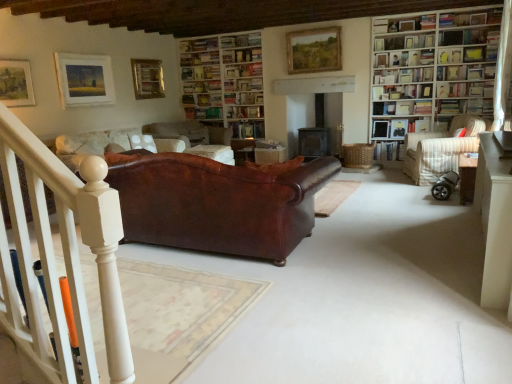
This screenshot has width=512, height=384. Identify the location of hardcover book at center, arranged as the 6th book when viewed from the right. (248, 129).

Describe the element at coordinates (314, 50) in the screenshot. I see `wooden picture frame at upper center, which appears as the second picture frame when viewed from the back` at that location.

The height and width of the screenshot is (384, 512). What are the coordinates of `black rubber baby carriage at lower right` in the screenshot? It's located at (445, 186).

This screenshot has height=384, width=512. I want to click on hardcover book at center, which is the 3th book from left to right, so click(x=248, y=129).

From a real-world perspective, is hardcover book at center, which is the 3th book from left to right, located higher than hardcover book at upper right, the fifth book positioned from the left?

No, from a real-world perspective, hardcover book at center, which is the 3th book from left to right, is not on top of hardcover book at upper right, the fifth book positioned from the left.

Would you say hardcover book at upper right, the fifth book positioned from the left, is part of hardcover book at center, arranged as the 6th book when viewed from the right,'s contents?

Actually, hardcover book at upper right, the fifth book positioned from the left, is outside hardcover book at center, arranged as the 6th book when viewed from the right.

Can you confirm if hardcover book at center, arranged as the 6th book when viewed from the right, is bigger than hardcover book at upper right, the fifth book positioned from the left?

Indeed, hardcover book at center, arranged as the 6th book when viewed from the right, has a larger size compared to hardcover book at upper right, the fifth book positioned from the left.

Does wooden bookshelf at upper right, placed as the first shelf when sorted from bottom to top, lie behind hardcover book at upper right, acting as the first book starting from the right?

That is True.

I want to click on shelf that is the 1st one when counting upward from the hardcover book at upper right, acting as the first book starting from the right (from the image's perspective), so click(x=464, y=89).

Would you say wooden bookshelf at upper right, placed as the first shelf when sorted from bottom to top, is outside hardcover book at upper right, the eighth book positioned from the left?

Yes.

Is point (437, 83) farther from camera compared to point (461, 109)?

No, (437, 83) is closer to viewer.

In the scene shown: Considering the sizes of objects wooden bookshelf at upper right, acting as the 1th shelf starting from the top, and white paper bookshelf at upper right, placed as the fourth book when sorted from left to right, in the image provided, who is bigger, wooden bookshelf at upper right, acting as the 1th shelf starting from the top, or white paper bookshelf at upper right, placed as the fourth book when sorted from left to right,?

white paper bookshelf at upper right, placed as the fourth book when sorted from left to right.

Can you confirm if wooden bookshelf at upper right, acting as the fourth shelf starting from the bottom, is shorter than white paper bookshelf at upper right, placed as the fourth book when sorted from left to right?

Yes, wooden bookshelf at upper right, acting as the fourth shelf starting from the bottom, is shorter than white paper bookshelf at upper right, placed as the fourth book when sorted from left to right.

How different are the orientations of wooden bookshelf at upper right, acting as the fourth shelf starting from the bottom, and white paper bookshelf at upper right, placed as the fourth book when sorted from left to right, in degrees?

The angle between the facing direction of wooden bookshelf at upper right, acting as the fourth shelf starting from the bottom, and the facing direction of white paper bookshelf at upper right, placed as the fourth book when sorted from left to right, is 1.42 degrees.

Which is less distant, (396, 48) or (394, 151)?

Point (396, 48).

Does green matte book at center, which is the eighth book from right to left, appear on the left side of wooden bookshelf at upper right, the 4th shelf positioned from the top?

Yes, green matte book at center, which is the eighth book from right to left, is to the left of wooden bookshelf at upper right, the 4th shelf positioned from the top.

Is green matte book at center, which is the eighth book from right to left, in front of or behind wooden bookshelf at upper right, placed as the first shelf when sorted from bottom to top, in the image?

In the image, green matte book at center, which is the eighth book from right to left, appears behind wooden bookshelf at upper right, placed as the first shelf when sorted from bottom to top.

How different are the orientations of green matte book at center, which is the eighth book from right to left, and wooden bookshelf at upper right, placed as the first shelf when sorted from bottom to top, in degrees?

green matte book at center, which is the eighth book from right to left, and wooden bookshelf at upper right, placed as the first shelf when sorted from bottom to top, are facing 1.64 degrees away from each other.

Is green matte book at center, which is the eighth book from right to left, completely or partially outside of wooden bookshelf at upper right, the 4th shelf positioned from the top?

Yes, green matte book at center, which is the eighth book from right to left, is not within wooden bookshelf at upper right, the 4th shelf positioned from the top.

Considering the relative sizes of wooden picture frame at upper center, which is the 3th picture frame in front-to-back order, and wooden table at right, the 1th table viewed from the back, in the image provided, is wooden picture frame at upper center, which is the 3th picture frame in front-to-back order, shorter than wooden table at right, the 1th table viewed from the back,?

In fact, wooden picture frame at upper center, which is the 3th picture frame in front-to-back order, may be taller than wooden table at right, the 1th table viewed from the back.

In the scene shown: Is wooden picture frame at upper center, the 4th picture frame in the left-to-right sequence, in front of or behind wooden table at right, the 1th table viewed from the back, in the image?

wooden picture frame at upper center, the 4th picture frame in the left-to-right sequence, is positioned farther from the viewer than wooden table at right, the 1th table viewed from the back.

Does wooden picture frame at upper center, acting as the first picture frame starting from the right, touch wooden table at right, the 2th table from the front?

No, wooden picture frame at upper center, acting as the first picture frame starting from the right, is not in contact with wooden table at right, the 2th table from the front.

Considering the relative positions of wooden picture frame at upper center, which appears as the second picture frame when viewed from the back, and wooden table at right, the 2th table from the front, in the image provided, is wooden picture frame at upper center, which appears as the second picture frame when viewed from the back, to the left or to the right of wooden table at right, the 2th table from the front,?

wooden picture frame at upper center, which appears as the second picture frame when viewed from the back, is positioned on wooden table at right, the 2th table from the front,'s left side.

Would you say black rubber baby carriage at lower right is inside or outside leather couch at center?

black rubber baby carriage at lower right is not enclosed by leather couch at center.

Based on the photo, is black rubber baby carriage at lower right looking in the opposite direction of leather couch at center?

No, black rubber baby carriage at lower right is not facing the opposite direction of leather couch at center.

Between matte white picture frame at upper left, acting as the third picture frame starting from the right, and wooden bookshelf at center, the second bookcase when ordered from front to back, which one has larger width?

wooden bookshelf at center, the second bookcase when ordered from front to back.

From the image's perspective, is matte white picture frame at upper left, acting as the third picture frame starting from the right, located beneath wooden bookshelf at center, arranged as the 1th bookcase when viewed from the left?

Indeed, from the image's perspective, matte white picture frame at upper left, acting as the third picture frame starting from the right, is shown beneath wooden bookshelf at center, arranged as the 1th bookcase when viewed from the left.

Does point (111, 99) come closer to viewer compared to point (239, 95)?

Yes, it is.

Measure the distance from matte white picture frame at upper left, the second picture frame in the left-to-right sequence, to wooden bookshelf at center, which ranks as the 2th bookcase in right-to-left order.

The distance of matte white picture frame at upper left, the second picture frame in the left-to-right sequence, from wooden bookshelf at center, which ranks as the 2th bookcase in right-to-left order, is 5.42 feet.

Locate an element on the screen. This screenshot has height=384, width=512. the 4th book below the hardcover book at upper right, which appears as the fourth book when viewed from the right (from the image's perspective) is located at coordinates (248, 129).

Locate an element on the screen. the 2nd book positioned below the wooden bookshelf at upper right, the 4th shelf positioned from the top (from a real-world perspective) is located at coordinates (465, 106).

In the scene shown: When comparing their distances from matte white picture frame at upper left, acting as the third picture frame starting from the right, does hardcover book at upper right, the second book positioned from the right, or wooden bookshelf at upper right, acting as the 1th shelf starting from the top, seem further?

hardcover book at upper right, the second book positioned from the right, is positioned further to the anchor matte white picture frame at upper left, acting as the third picture frame starting from the right.

Which object lies nearer to the anchor point white paper bookshelf at upper right, the 5th book positioned from the right, white wooden bookcase at right, which is counted as the second bookcase, starting from the left, or wooden bookshelf at center, acting as the 1th bookcase starting from the back?

The object closer to white paper bookshelf at upper right, the 5th book positioned from the right, is white wooden bookcase at right, which is counted as the second bookcase, starting from the left.

Based on their spatial positions, is matte white picture frame at upper left, marked as the second picture frame in a front-to-back arrangement, or white glossy bookshelf at upper right, which ranks as the second shelf in bottom-to-top order, further from wooden bookshelf at upper right, placed as the first shelf when sorted from bottom to top?

matte white picture frame at upper left, marked as the second picture frame in a front-to-back arrangement.

When comparing their distances from hardcover book at center, which is counted as the seventh book, starting from the right, does hardcover book at upper right, the fifth book positioned from the left, or green matte book at center, which is the eighth book from right to left, seem further?

hardcover book at upper right, the fifth book positioned from the left, is positioned further to the anchor hardcover book at center, which is counted as the seventh book, starting from the right.

From the image, which object appears to be farther from white glossy table at lower right, arranged as the second table when viewed from the back, hardcover book at upper right, the 7th book in the left-to-right sequence, or white paper bookshelf at upper right, placed as the fourth book when sorted from left to right?

Among the two, white paper bookshelf at upper right, placed as the fourth book when sorted from left to right, is located further to white glossy table at lower right, arranged as the second table when viewed from the back.

Which object lies further to the anchor point white paper bookshelf at upper right, placed as the fourth book when sorted from left to right, striped fabric armchair at right or hardcover book at upper right, the 7th book in the left-to-right sequence?

striped fabric armchair at right is further to white paper bookshelf at upper right, placed as the fourth book when sorted from left to right.

Estimate the real-world distances between objects in this image. Which object is further from wooden table at right, the 2th table from the front, white wooden bookcase at right, which ranks as the 1th bookcase in right-to-left order, or hardcover book at center, arranged as the 6th book when viewed from the right?

The object further to wooden table at right, the 2th table from the front, is hardcover book at center, arranged as the 6th book when viewed from the right.

Estimate the real-world distances between objects in this image. Which object is closer to wooden bookshelf at upper right, the 2th shelf when ordered from top to bottom, hardcover book at upper right, the 7th book in the left-to-right sequence, or wooden bookshelf at upper right, the 4th shelf positioned from the top?

hardcover book at upper right, the 7th book in the left-to-right sequence, is positioned closer to the anchor wooden bookshelf at upper right, the 2th shelf when ordered from top to bottom.

The image size is (512, 384). What are the coordinates of `studio couch between matte white picture frame at upper left, acting as the third picture frame starting from the right, and white glossy table at lower right, arranged as the second table when viewed from the back, in the horizontal direction` in the screenshot? It's located at (217, 204).

Where is `baby carriage between white glossy table at lower right, marked as the first table in a front-to-back arrangement, and green matte book at center, which is the eighth book from right to left, from front to back`? The image size is (512, 384). baby carriage between white glossy table at lower right, marked as the first table in a front-to-back arrangement, and green matte book at center, which is the eighth book from right to left, from front to back is located at coordinates (445, 186).

At what (x,y) coordinates should I click in order to perform the action: click on chair between wooden bookshelf at center, which ranks as the 2th bookcase in right-to-left order, and white wooden bookcase at right, which ranks as the 1th bookcase in right-to-left order, in the horizontal direction. Please return your answer as a coordinate pair (x, y). Looking at the image, I should click on (440, 149).

Find the location of a particular element. This screenshot has width=512, height=384. baby carriage located between wooden table at right, the 1th table viewed from the back, and wooden bookshelf at upper right, placed as the first shelf when sorted from bottom to top, in the depth direction is located at coordinates (445, 186).